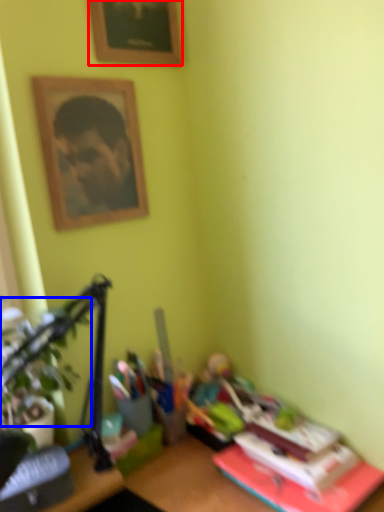
Question: Among these objects, which one is farthest to the camera, picture frame (highlighted by a red box) or plant (highlighted by a blue box)?

Choices:
 (A) picture frame
 (B) plant

Answer: (A)